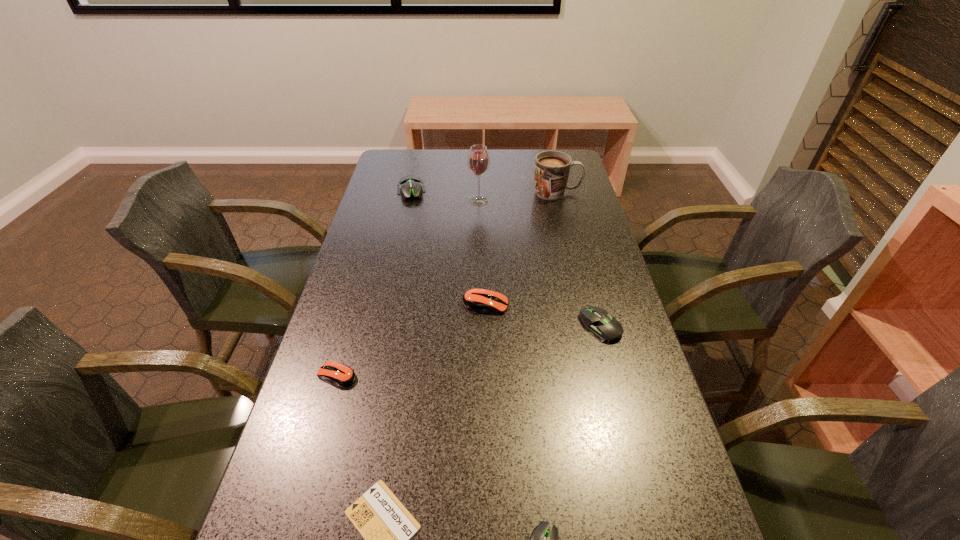
This screenshot has width=960, height=540. Identify the location of the left orange computer mouse. (341, 375).

Where is `vacant region located on the back of the wineglass`? Image resolution: width=960 pixels, height=540 pixels. vacant region located on the back of the wineglass is located at coordinates (479, 163).

At what (x,y) coordinates should I click in order to perform the action: click on vacant space situated 0.230m on the front of the leftmost gray computer mouse. Please return your answer as a coordinate pair (x, y). Image resolution: width=960 pixels, height=540 pixels. Looking at the image, I should click on (399, 244).

At what (x,y) coordinates should I click in order to perform the action: click on free space located on the right of the right orange computer mouse. Please return your answer as a coordinate pair (x, y). The width and height of the screenshot is (960, 540). Looking at the image, I should click on (563, 305).

This screenshot has height=540, width=960. In order to click on free space located on the front of the second nearest gray computer mouse in this screenshot , I will do `click(614, 375)`.

You are a GUI agent. You are given a task and a screenshot of the screen. Output one action in this format:
    pyautogui.click(x=<x>, y=<y>)
    Task: Click on the vacant space located 0.390m on the back of the fourth farthest computer mouse
    The image size is (960, 540).
    Given the screenshot: What is the action you would take?
    pyautogui.click(x=372, y=255)

Where is `mug situated at the right edge`? mug situated at the right edge is located at coordinates (552, 168).

In order to click on computer mouse at the right edge in this screenshot , I will do `click(603, 327)`.

In the image, there is a desktop. Where is `vacant space at the left edge`? The image size is (960, 540). vacant space at the left edge is located at coordinates [389, 292].

The image size is (960, 540). In the image, there is a desktop. In order to click on vacant region at the right edge in this screenshot , I will do `click(587, 426)`.